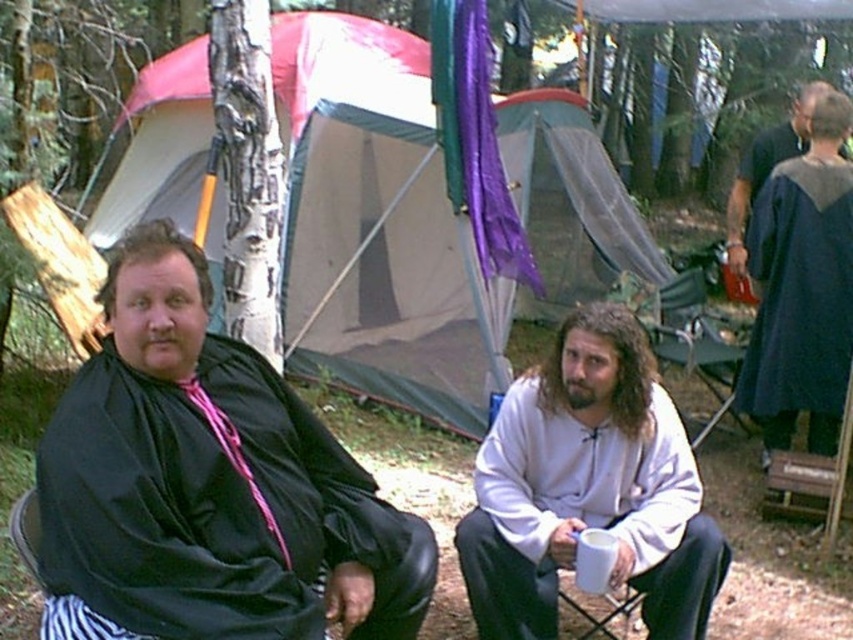
Does white matte sweatshirt at center have a greater height compared to dark blue fabric robe at right?

No, white matte sweatshirt at center is not taller than dark blue fabric robe at right.

Between point (642, 460) and point (809, 353), which one is positioned behind?

Positioned behind is point (809, 353).

Is point (619, 356) positioned before point (821, 157)?

Yes.

Locate an element on the screen. Image resolution: width=853 pixels, height=640 pixels. white matte sweatshirt at center is located at coordinates (589, 486).

Locate an element on the screen. Image resolution: width=853 pixels, height=640 pixels. black matte robe at left is located at coordinates (215, 506).

Between black matte robe at left and dark blue fabric robe at right, which one has less height?

black matte robe at left

Is point (190, 451) positioned in front of point (775, 406)?

Yes, it is in front of point (775, 406).

You are a GUI agent. You are given a task and a screenshot of the screen. Output one action in this format:
    pyautogui.click(x=<x>, y=<y>)
    Task: Click on the black matte robe at left
    Image resolution: width=853 pixels, height=640 pixels.
    Given the screenshot: What is the action you would take?
    pyautogui.click(x=215, y=506)

Measure the distance between black matte robe at left and metallic folding chair at center.

3.20 meters

Which of these two, black matte robe at left or metallic folding chair at center, stands shorter?

With less height is black matte robe at left.

Between point (56, 554) and point (671, 337), which one is positioned in front?

Positioned in front is point (56, 554).

Where is `black matte robe at left`? This screenshot has height=640, width=853. black matte robe at left is located at coordinates (215, 506).